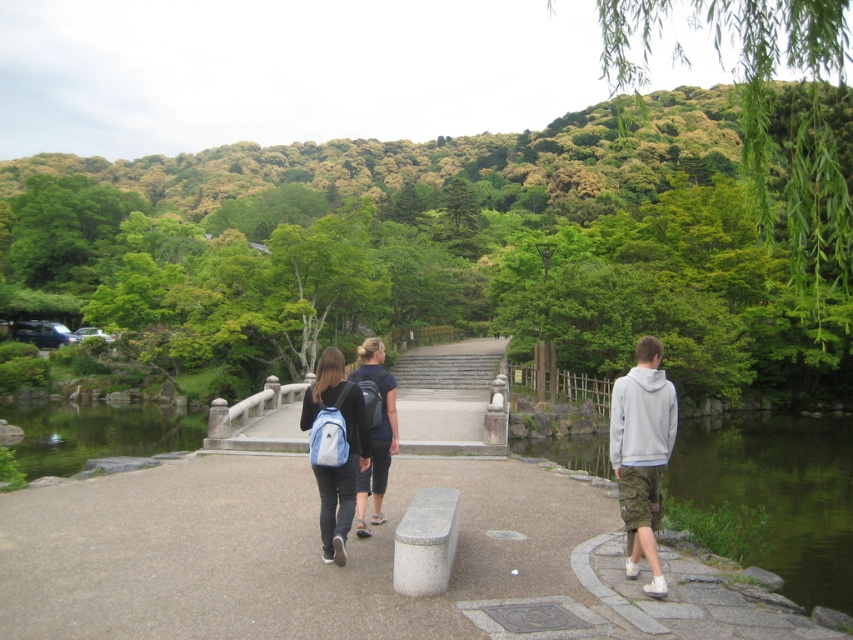
Question: Among these points, which one is farthest from the camera?

Choices:
 (A) (384, 353)
 (B) (80, 404)
 (C) (53, 516)
 (D) (370, 456)

Answer: (B)

Question: Does smooth concrete path at center appear on the right side of light blue backpack at center?

Choices:
 (A) no
 (B) yes

Answer: (B)

Question: Which point is closer to the camera?

Choices:
 (A) gray cotton hoodie at right
 (B) smooth stone steps at center
 (C) matte black backpack at center

Answer: (A)

Question: Estimate the real-world distances between objects in this image. Which object is closer to the gray cotton hoodie at right?

Choices:
 (A) green smooth water at lower left
 (B) smooth concrete path at center
 (C) light blue backpack at center

Answer: (B)

Question: In this image, where is smooth concrete path at center located relative to gray cotton hoodie at right?

Choices:
 (A) above
 (B) below

Answer: (B)

Question: Is green stone river at lower right closer to the viewer compared to matte black backpack at center?

Choices:
 (A) yes
 (B) no

Answer: (A)